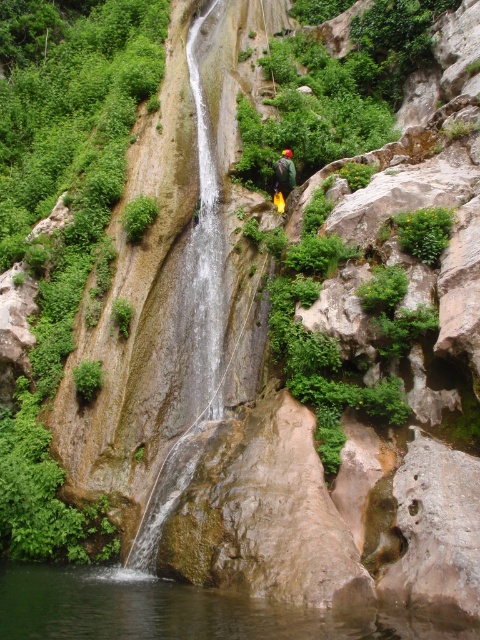
What do you see at coordinates (177, 611) in the screenshot?
I see `clear water at center` at bounding box center [177, 611].

Is point (251, 614) behind point (279, 177)?

No, it is not.

Image resolution: width=480 pixels, height=640 pixels. I want to click on clear water at center, so click(177, 611).